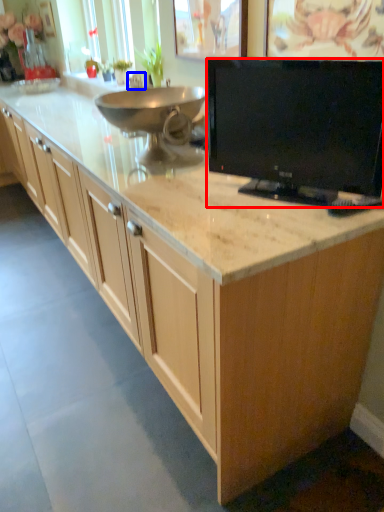
Question: Which point is further to the camera, television (highlighted by a red box) or faucet (highlighted by a blue box)?

Choices:
 (A) television
 (B) faucet

Answer: (B)